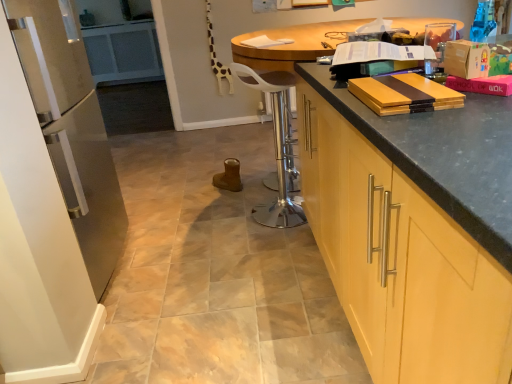
I want to click on vacant region above white paper at center, the fourth book from the bottom (from a real-world perspective), so click(x=258, y=38).